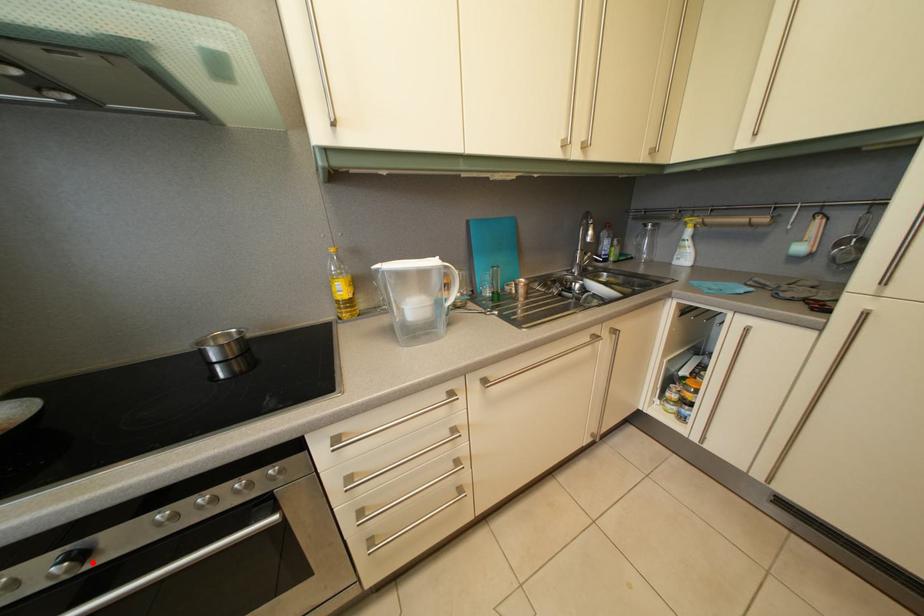
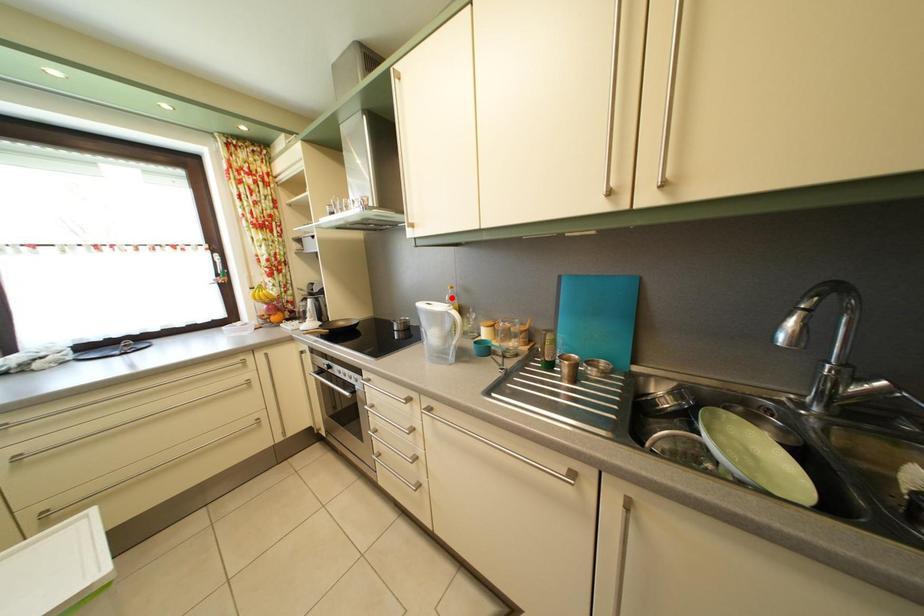
I am providing you with two images of the same scene from different viewpoints. A red point is marked on the first image and another point is marked on the second image. Is the red point in image1 aligned with the point shown in image2?

No